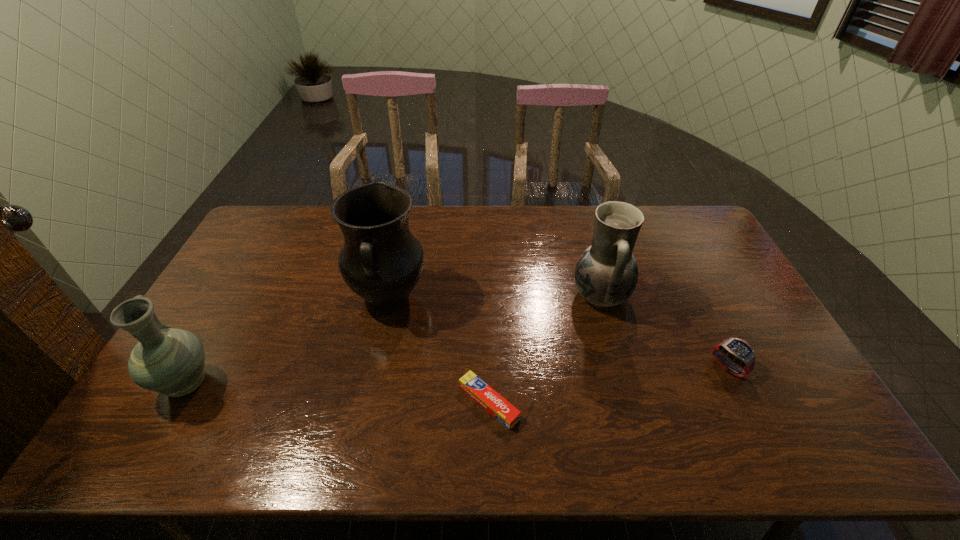
Find the location of a particular element. The image size is (960, 540). blank space located 0.230m on the front-facing side of the rightmost pitcher is located at coordinates (498, 295).

Locate an element on the screen. The image size is (960, 540). free space located on the front-facing side of the rightmost pitcher is located at coordinates (444, 295).

Where is `free space located 0.240m on the handle side of the nearest pitcher`? free space located 0.240m on the handle side of the nearest pitcher is located at coordinates (236, 297).

Locate an element on the screen. Image resolution: width=960 pixels, height=540 pixels. free space located 0.060m on the handle side of the nearest pitcher is located at coordinates pyautogui.click(x=211, y=342).

Where is `vacant space located on the handle side of the nearest pitcher`? The width and height of the screenshot is (960, 540). vacant space located on the handle side of the nearest pitcher is located at coordinates (228, 311).

The image size is (960, 540). Find the location of `vacant space located 0.100m on the right of the rightmost object`. vacant space located 0.100m on the right of the rightmost object is located at coordinates (780, 367).

Where is `vacant space located on the back of the shortest object`? vacant space located on the back of the shortest object is located at coordinates (488, 313).

Where is `object located at the near edge`? The height and width of the screenshot is (540, 960). object located at the near edge is located at coordinates (487, 397).

Where is `object present at the left edge`? Image resolution: width=960 pixels, height=540 pixels. object present at the left edge is located at coordinates (170, 361).

In order to click on object located at the right edge in this screenshot , I will do `click(738, 351)`.